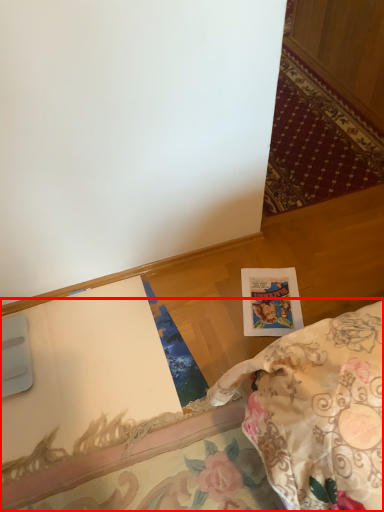
Question: From the image, what is the correct spatial relationship of furniture (annotated by the red box) in relation to postcard?

Choices:
 (A) left
 (B) right

Answer: (A)